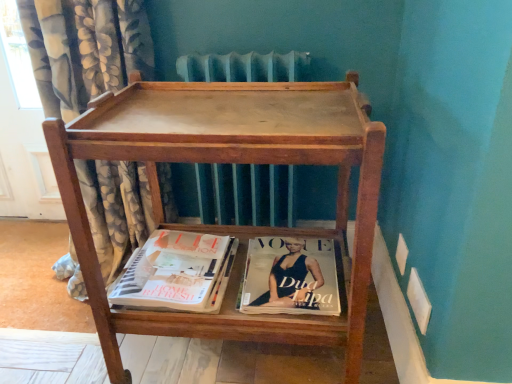
You are a GUI agent. You are given a task and a screenshot of the screen. Output one action in this format:
    pyautogui.click(x=<x>, y=<y>)
    Task: Click on the blank space situated above matte paper magazine at lower center (from a real-world perspective)
    This screenshot has height=384, width=512.
    Given the screenshot: What is the action you would take?
    pyautogui.click(x=282, y=267)